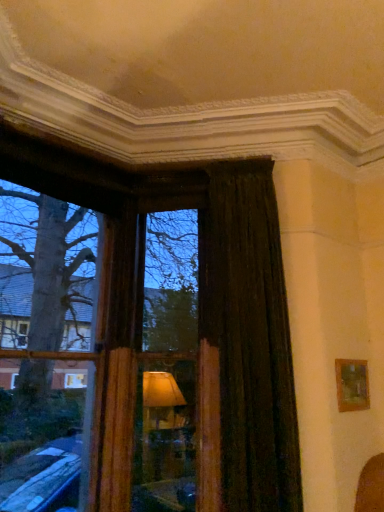
Where is `wooden frame at left`? The image size is (384, 512). wooden frame at left is located at coordinates (95, 353).

At what (x,y) coordinates should I click in order to perform the action: click on wooden picture frame at right. Please return your answer as a coordinate pair (x, y). Looking at the image, I should click on pos(352,385).

Measure the distance between dark velvet curtain at right and camera.

dark velvet curtain at right and camera are 2.47 meters apart.

The image size is (384, 512). What do you see at coordinates (244, 349) in the screenshot? I see `dark velvet curtain at right` at bounding box center [244, 349].

Where is `wooden frame at left`? The width and height of the screenshot is (384, 512). wooden frame at left is located at coordinates (95, 353).

Is wooden frame at left to the left of wooden frame at center from the viewer's perspective?

Indeed, wooden frame at left is positioned on the left side of wooden frame at center.

Can you see wooden frame at left touching wooden frame at center?

They are not placed beside each other.

Consider the image. Is wooden frame at left wider than wooden frame at center?

Yes, wooden frame at left is wider than wooden frame at center.

Looking at this image, from the image's perspective, is wooden frame at left located above wooden frame at center?

Indeed, from the image's perspective, wooden frame at left is shown above wooden frame at center.

Considering the sizes of objects wooden frame at center and wooden frame at left in the image provided, who is smaller, wooden frame at center or wooden frame at left?

wooden frame at center is smaller.

Relative to wooden frame at left, is wooden frame at center in front or behind?

wooden frame at center is positioned farther from the viewer than wooden frame at left.

Is there a large distance between wooden frame at center and wooden frame at left?

No, there isn't a large distance between wooden frame at center and wooden frame at left.

Considering the positions of objects wooden frame at center and wooden frame at left in the image provided, who is more to the right, wooden frame at center or wooden frame at left?

wooden frame at center is more to the right.

In the image, is dark velvet curtain at right positioned in front of or behind wooden picture frame at right?

dark velvet curtain at right is in front of wooden picture frame at right.

Based on the photo, can you confirm if dark velvet curtain at right is bigger than wooden picture frame at right?

Yes.

From the image's perspective, which one is positioned higher, dark velvet curtain at right or wooden picture frame at right?

dark velvet curtain at right appears higher in the image.

Is point (244, 322) behind point (365, 360)?

No, it is not.

Is wooden frame at center far away from dark velvet curtain at right?

No, there isn't a large distance between wooden frame at center and dark velvet curtain at right.

Is wooden frame at center outside of dark velvet curtain at right?

wooden frame at center is positioned outside dark velvet curtain at right.

Which of these two, wooden frame at center or dark velvet curtain at right, is bigger?

dark velvet curtain at right is bigger.

How different are the orientations of wooden frame at center and dark velvet curtain at right in degrees?

3.07 degrees.

Based on the photo, which of these two, wooden picture frame at right or dark velvet curtain at right, is smaller?

wooden picture frame at right is smaller.

Considering the points (345, 405) and (207, 255), which point is behind, point (345, 405) or point (207, 255)?

The point (207, 255) is more distant.

What's the angular difference between wooden picture frame at right and dark velvet curtain at right's facing directions?

The angle between the facing direction of wooden picture frame at right and the facing direction of dark velvet curtain at right is 50.4 degrees.

From the picture: From a real-world perspective, is wooden picture frame at right located beneath dark velvet curtain at right?

Yes, from a real-world perspective, wooden picture frame at right is beneath dark velvet curtain at right.

Is wooden picture frame at right inside wooden frame at center?

No, wooden picture frame at right is not inside wooden frame at center.

Is wooden frame at center far from wooden picture frame at right?

Indeed, wooden frame at center is not near wooden picture frame at right.

Which is in front, point (157, 505) or point (352, 407)?

The point (352, 407) is more forward.

Is wooden frame at center shorter than wooden picture frame at right?

No.

Is wooden frame at left not close to dark velvet curtain at right?

No, wooden frame at left is not far away from dark velvet curtain at right.

Looking at this image, how different are the orientations of wooden frame at left and dark velvet curtain at right in degrees?

There is a 53.3-degree angle between the facing directions of wooden frame at left and dark velvet curtain at right.

From the image's perspective, which is below, wooden frame at left or dark velvet curtain at right?

wooden frame at left.

Identify the location of curtain that appears above the wooden frame at left (from the image's perspective). The height and width of the screenshot is (512, 384). (244, 349).

At what (x,y) coordinates should I click in order to perform the action: click on bay window that appears in front of the wooden frame at center. Please return your answer as a coordinate pair (x, y). This screenshot has height=512, width=384. Looking at the image, I should click on (95, 353).

This screenshot has height=512, width=384. In order to click on window frame to the right of wooden frame at left in this screenshot , I will do `click(164, 437)`.

Looking at the image, which one is located further to wooden frame at center, dark velvet curtain at right or wooden picture frame at right?

wooden picture frame at right lies further to wooden frame at center than the other object.

From the image, which object appears to be nearer to wooden frame at center, wooden picture frame at right or wooden frame at left?

wooden frame at left lies closer to wooden frame at center than the other object.

Considering their positions, is wooden frame at left positioned further to dark velvet curtain at right than wooden frame at center?

wooden frame at left lies further to dark velvet curtain at right than the other object.

Looking at the image, which one is located further to wooden picture frame at right, dark velvet curtain at right or wooden frame at center?

Based on the image, wooden frame at center appears to be further to wooden picture frame at right.

From the image, which object appears to be nearer to dark velvet curtain at right, wooden picture frame at right or wooden frame at center?

The object closer to dark velvet curtain at right is wooden frame at center.

Considering their positions, is wooden picture frame at right positioned further to wooden frame at left than wooden frame at center?

wooden picture frame at right is further to wooden frame at left.

In the scene shown: Considering their positions, is wooden frame at left positioned further to wooden picture frame at right than wooden frame at center?

wooden frame at left lies further to wooden picture frame at right than the other object.

Considering their positions, is wooden picture frame at right positioned closer to wooden frame at center than dark velvet curtain at right?

dark velvet curtain at right lies closer to wooden frame at center than the other object.

Where is `window frame located between wooden frame at left and wooden picture frame at right in the left-right direction`? window frame located between wooden frame at left and wooden picture frame at right in the left-right direction is located at coordinates (164, 437).

Find the location of a particular element. curtain located between wooden frame at left and wooden picture frame at right in the left-right direction is located at coordinates 244,349.

The width and height of the screenshot is (384, 512). Identify the location of window frame located between wooden frame at left and dark velvet curtain at right in the left-right direction. (164, 437).

The height and width of the screenshot is (512, 384). Identify the location of curtain between wooden frame at center and wooden picture frame at right in the horizontal direction. (244, 349).